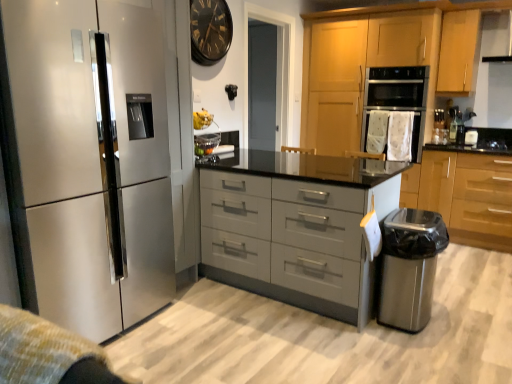
Question: Looking at the image, does satin metallic refrigerator at left seem bigger or smaller compared to satin grey drawers at center?

Choices:
 (A) big
 (B) small

Answer: (B)

Question: Is satin metallic refrigerator at left inside the boundaries of satin grey drawers at center, or outside?

Choices:
 (A) inside
 (B) outside

Answer: (B)

Question: Which object is positioned closest to the light wood/finished cabinet at upper right, the second cabinetry from the left?

Choices:
 (A) stainless steel trash can at lower right, placed as the 2th appliance when sorted from back to front
 (B) satin metallic refrigerator at left
 (C) satin silver refrigerator at left
 (D) satin wood cabinet at lower right, positioned as the first cabinetry in right-to-left order
 (E) light wood cabinet at upper right, the first cabinetry from the left

Answer: (E)

Question: Which object is positioned farthest from the satin grey drawers at center?

Choices:
 (A) satin wood cabinet at lower right, positioned as the first cabinetry in right-to-left order
 (B) white fabric oven at center
 (C) light wood/finished cabinet at upper right, which is the 2th cabinetry from right to left
 (D) satin metallic refrigerator at left
 (E) black glossy coffee machine at upper right, which is the second appliance from bottom to top

Answer: (E)